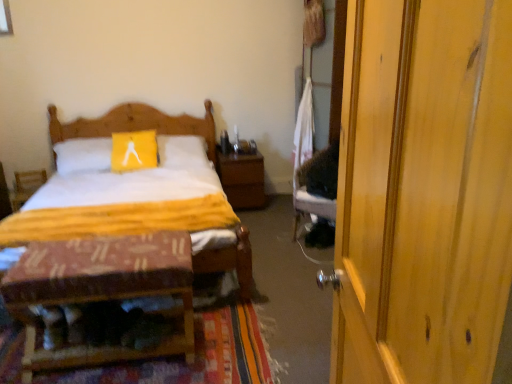
Question: Does textured woolen mat at lower left have a lesser height compared to wooden armchair at left?

Choices:
 (A) no
 (B) yes

Answer: (B)

Question: Can you confirm if textured woolen mat at lower left is wider than wooden armchair at left?

Choices:
 (A) yes
 (B) no

Answer: (A)

Question: Is textured woolen mat at lower left not inside wooden armchair at left?

Choices:
 (A) yes
 (B) no

Answer: (A)

Question: From a real-world perspective, is textured woolen mat at lower left located higher than wooden armchair at left?

Choices:
 (A) no
 (B) yes

Answer: (A)

Question: From the image's perspective, is textured woolen mat at lower left located beneath wooden armchair at left?

Choices:
 (A) no
 (B) yes

Answer: (B)

Question: Is wooden patterned stool at lower left spatially inside wooden nightstand at center, or outside of it?

Choices:
 (A) inside
 (B) outside

Answer: (B)

Question: Considering the relative positions of wooden patterned stool at lower left and wooden nightstand at center in the image provided, is wooden patterned stool at lower left to the left or to the right of wooden nightstand at center?

Choices:
 (A) right
 (B) left

Answer: (B)

Question: From a real-world perspective, is wooden patterned stool at lower left physically located above or below wooden nightstand at center?

Choices:
 (A) below
 (B) above

Answer: (B)

Question: From the image's perspective, relative to wooden nightstand at center, is wooden patterned stool at lower left above or below?

Choices:
 (A) above
 (B) below

Answer: (B)

Question: From a real-world perspective, relative to wooden armchair at left, is textured woolen mat at lower left vertically above or below?

Choices:
 (A) above
 (B) below

Answer: (B)

Question: In terms of width, does textured woolen mat at lower left look wider or thinner when compared to wooden armchair at left?

Choices:
 (A) wide
 (B) thin

Answer: (A)

Question: In terms of size, does textured woolen mat at lower left appear bigger or smaller than wooden armchair at left?

Choices:
 (A) small
 (B) big

Answer: (B)

Question: Is textured woolen mat at lower left inside or outside of wooden armchair at left?

Choices:
 (A) outside
 (B) inside

Answer: (A)

Question: Considering the positions of point [x=117, y=372] and point [x=459, y=326], is point [x=117, y=372] closer or farther from the camera than point [x=459, y=326]?

Choices:
 (A) closer
 (B) farther

Answer: (B)

Question: From their relative heights in the image, would you say textured woolen mat at lower left is taller or shorter than wooden door at right?

Choices:
 (A) tall
 (B) short

Answer: (B)